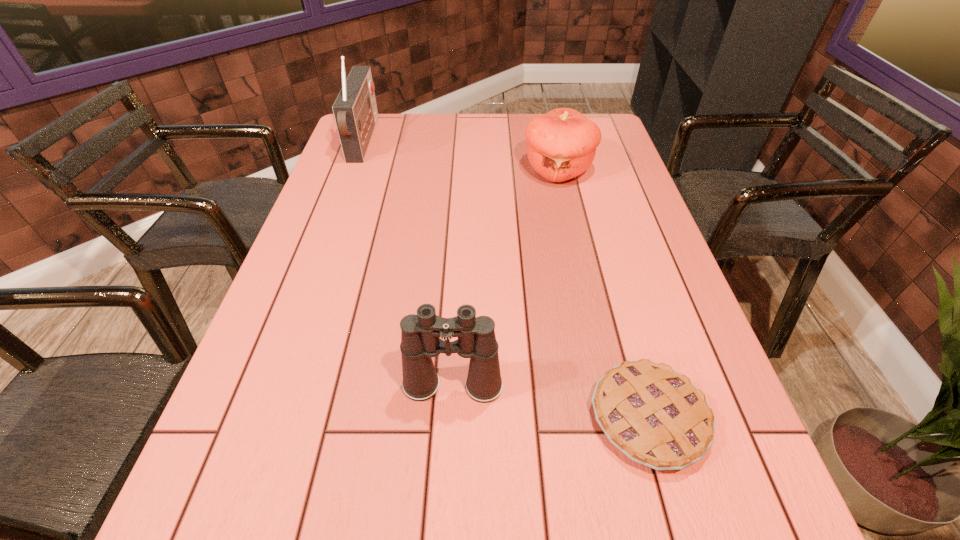
Locate an element on the screen. free space that is in between the shortest object and the second shortest object is located at coordinates (603, 294).

Locate an element on the screen. The width and height of the screenshot is (960, 540). free space between the shortest object and the radio receiver is located at coordinates 506,280.

Image resolution: width=960 pixels, height=540 pixels. I want to click on vacant space that is in between the pie and the third shortest object, so (550, 402).

This screenshot has width=960, height=540. I want to click on empty location between the shortest object and the third tallest object, so click(603, 294).

Locate an element on the screen. This screenshot has width=960, height=540. free space between the third object from right to left and the pumpkin is located at coordinates (505, 278).

The image size is (960, 540). I want to click on empty location between the shortest object and the pumpkin, so click(x=603, y=294).

At what (x,y) coordinates should I click in order to perform the action: click on free space between the pumpkin and the binoculars. Please return your answer as a coordinate pair (x, y). The width and height of the screenshot is (960, 540). Looking at the image, I should click on (505, 278).

Locate an element on the screen. This screenshot has width=960, height=540. free space between the third shortest object and the pie is located at coordinates (550, 402).

What are the coordinates of `free spot between the shortest object and the binoculars` in the screenshot? It's located at point(550,402).

Choose which object is the nearest neighbor to the pie. Please provide its 2D coordinates. Your answer should be formatted as a tuple, i.e. [(x, y)], where the tuple contains the x and y coordinates of a point satisfying the conditions above.

[(420, 333)]